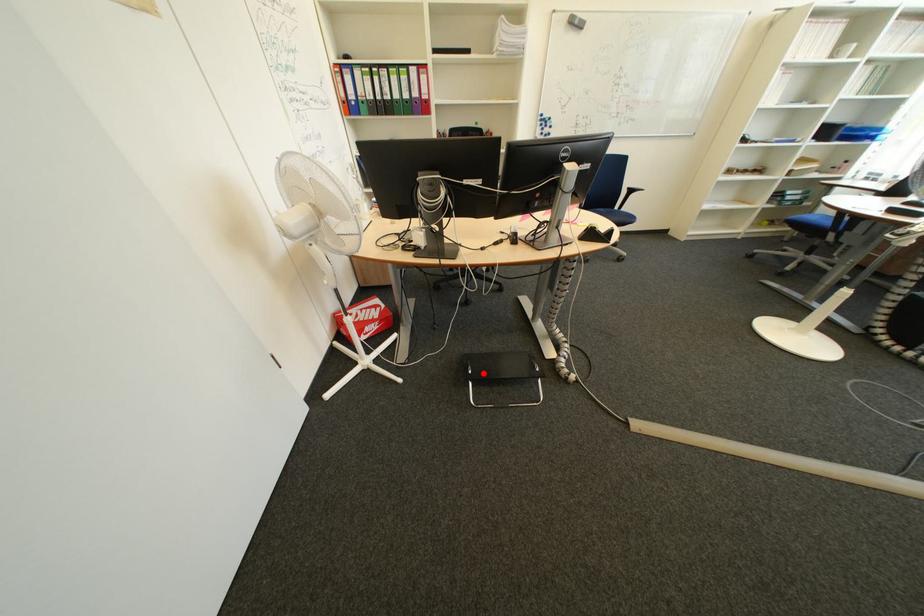
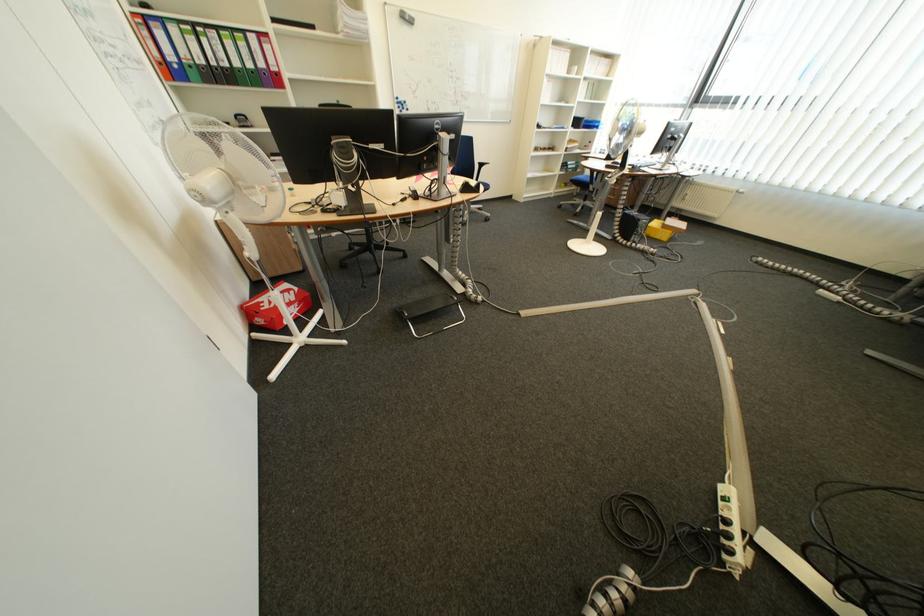
Question: I am providing you with two images of the same scene from different viewpoints. In image1, a red point is highlighted. Considering the same 3D point in image2, which of the following is correct?

Choices:
 (A) It is closer
 (B) It is farther

Answer: (A)